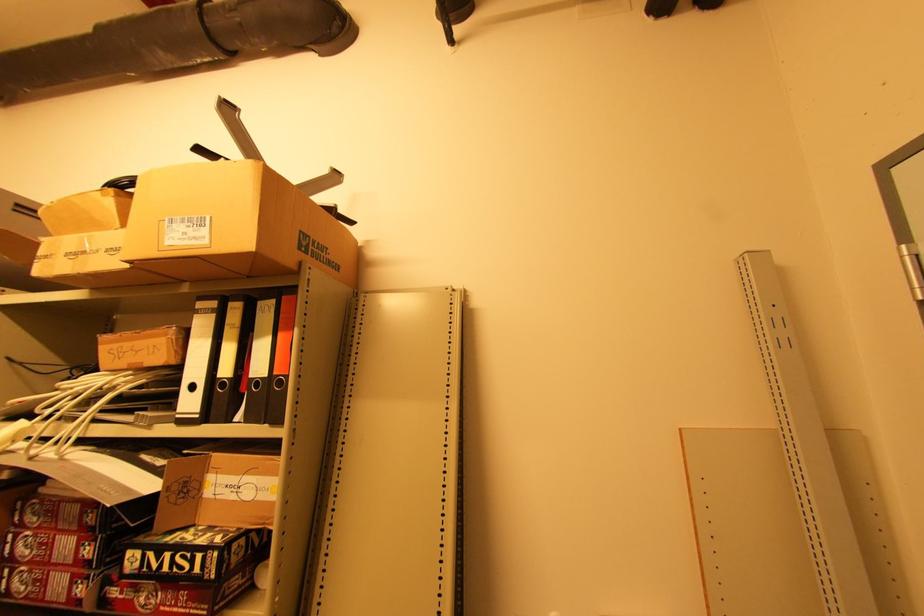
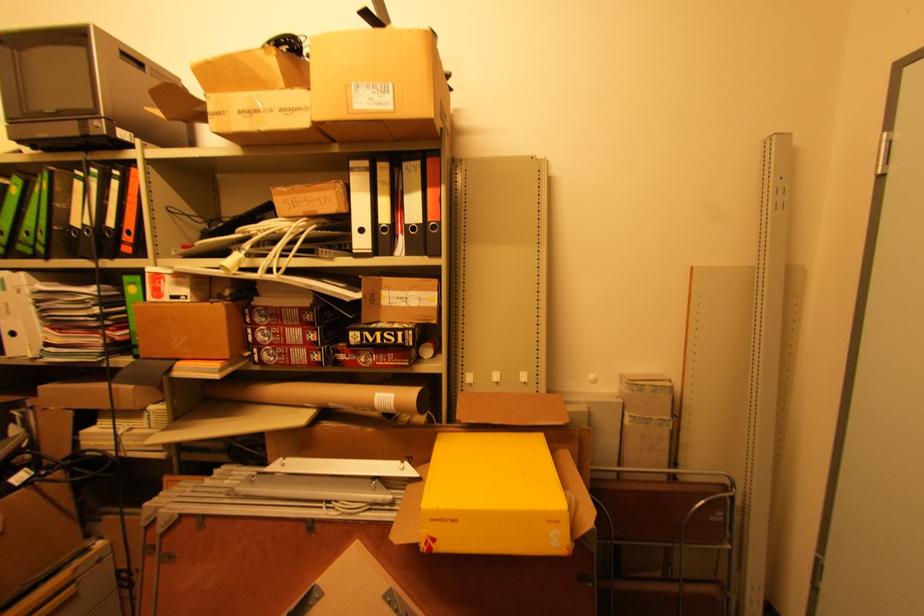
Where in the second image is the point corresponding to pixel 223 377 from the first image?

(383, 223)